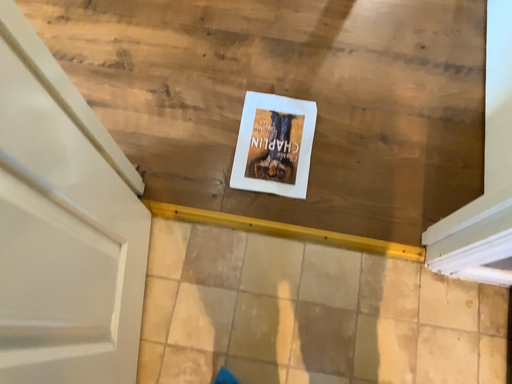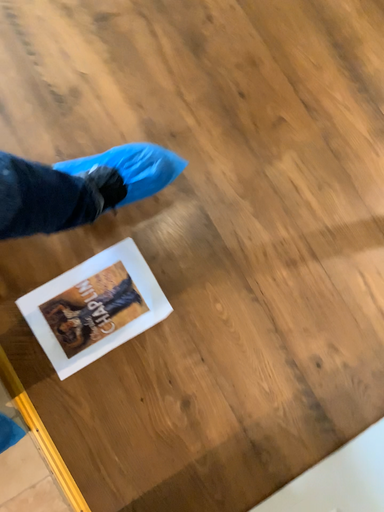
Question: Which way did the camera rotate in the video?

Choices:
 (A) rotated right
 (B) rotated left

Answer: (B)